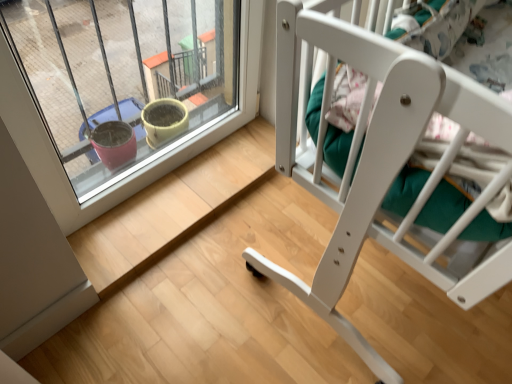
Locate an element on the screen. The width and height of the screenshot is (512, 384). white matte crib at right is located at coordinates (443, 207).

Describe the element at coordinates (443, 207) in the screenshot. The width and height of the screenshot is (512, 384). I see `white matte crib at right` at that location.

Image resolution: width=512 pixels, height=384 pixels. What are the coordinates of `white matte crib at right` in the screenshot? It's located at click(x=443, y=207).